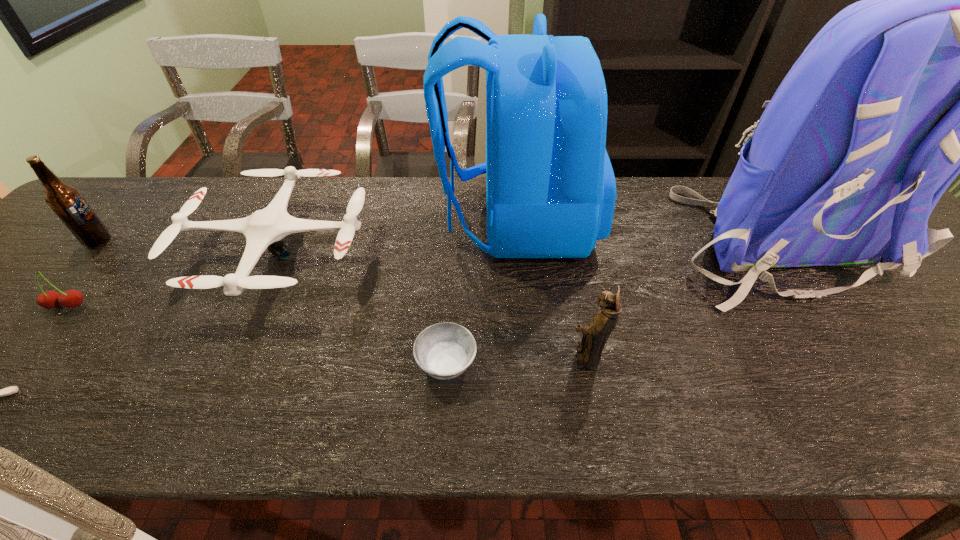
At what (x,y) coordinates should I click in order to perform the action: click on vacant position located 0.270m on the back of the shorter backpack. Please return your answer as a coordinate pair (x, y). Looking at the image, I should click on (340, 221).

The image size is (960, 540). I want to click on blank space located on the back of the shorter backpack, so click(372, 221).

Where is `free space located 0.190m on the back of the shorter backpack`? This screenshot has height=540, width=960. free space located 0.190m on the back of the shorter backpack is located at coordinates (370, 221).

This screenshot has height=540, width=960. I want to click on free space located on the label of the third tallest object, so click(x=175, y=241).

At what (x,y) coordinates should I click in order to perform the action: click on vacant region located on the front-facing side of the figurine. Please return your answer as a coordinate pair (x, y). Looking at the image, I should click on (517, 356).

I want to click on free space located 0.260m on the front-facing side of the figurine, so click(440, 356).

Where is `free space located on the front-facing side of the figurine`? free space located on the front-facing side of the figurine is located at coordinates (411, 356).

I want to click on blank space located with the camera attached at the bottom of the drone, so click(x=481, y=252).

Where is `free spot located 0.120m on the surface of the cherry`? free spot located 0.120m on the surface of the cherry is located at coordinates (22, 359).

Find the location of a particular element. This screenshot has height=540, width=960. blank space located 0.350m on the back of the seventh tallest object is located at coordinates (454, 232).